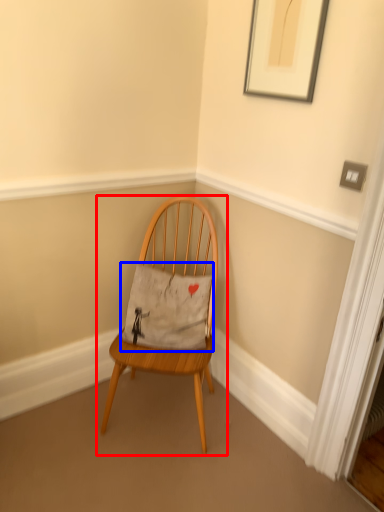
Question: Which object is closer to the camera taking this photo, chair (highlighted by a red box) or pillow (highlighted by a blue box)?

Choices:
 (A) chair
 (B) pillow

Answer: (A)